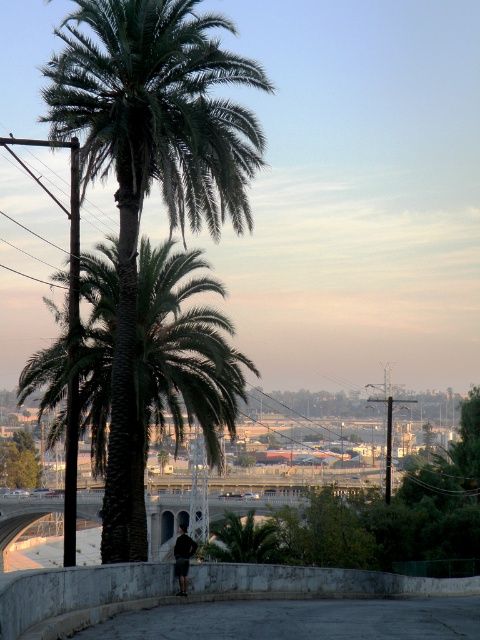
Based on the photo, how distant is concrete ledge at lower center from dark gray fabric pants at center?

concrete ledge at lower center is 8.82 meters away from dark gray fabric pants at center.

Does concrete ledge at lower center appear on the left side of dark gray fabric pants at center?

In fact, concrete ledge at lower center is to the right of dark gray fabric pants at center.

The width and height of the screenshot is (480, 640). What do you see at coordinates (191, 592) in the screenshot?
I see `concrete ledge at lower center` at bounding box center [191, 592].

The image size is (480, 640). Identify the location of concrete ledge at lower center. (191, 592).

Can you confirm if green leafy palm tree at center is positioned below dark gray fabric pants at center?

No.

Is the position of green leafy palm tree at center more distant than that of dark gray fabric pants at center?

No.

Find the location of a particular element. This screenshot has width=480, height=640. green leafy palm tree at center is located at coordinates (151, 172).

I want to click on green leafy palm tree at center, so click(x=151, y=172).

Is point (97, 99) closer to viewer compared to point (420, 580)?

Yes.

Which of these two, green leafy palm tree at center or concrete ledge at lower center, stands taller?

green leafy palm tree at center

At what (x,y) coordinates should I click in order to perform the action: click on green leafy palm tree at center. Please return your answer as a coordinate pair (x, y). Image resolution: width=480 pixels, height=640 pixels. Looking at the image, I should click on (151, 172).